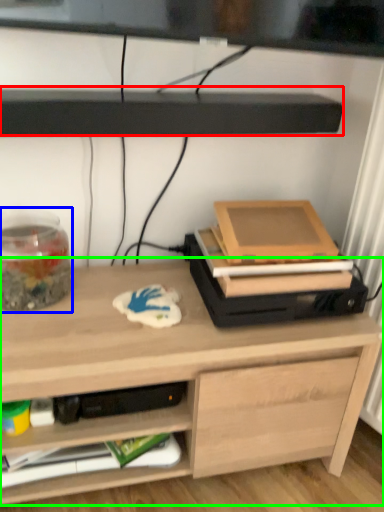
Question: Which object is positioned closest to shelf (highlighted by a red box)? Select from glass jar (highlighted by a blue box) and desk (highlighted by a green box).

Choices:
 (A) glass jar
 (B) desk

Answer: (A)